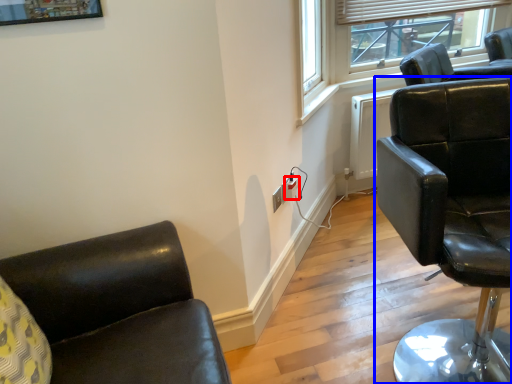
Question: Which point is closer to the camera, electric outlet (highlighted by a red box) or chair (highlighted by a blue box)?

Choices:
 (A) electric outlet
 (B) chair

Answer: (B)